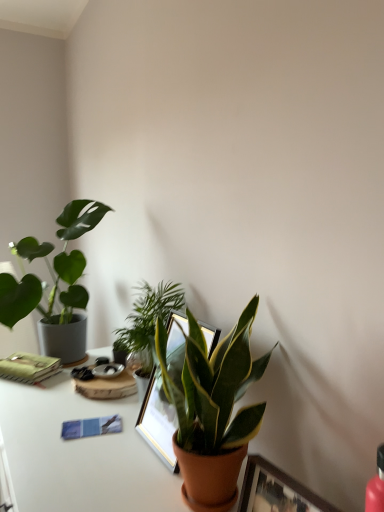
This screenshot has height=512, width=384. Find the location of `vacant area that lies in front of green matte notebook at left`. vacant area that lies in front of green matte notebook at left is located at coordinates (21, 394).